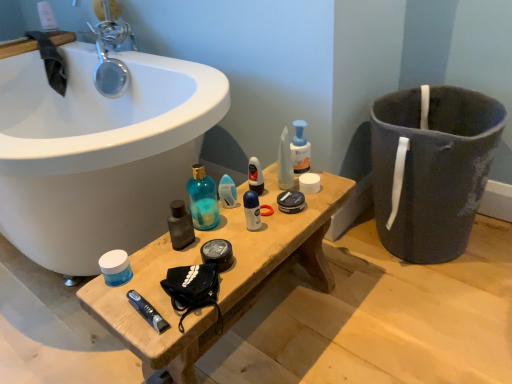
Question: Does blue matte jar at center, the first mouthwash in the left-to-right sequence, appear on the left side of shiny plastic mouthwash at center, acting as the second mouthwash starting from the front?

Choices:
 (A) yes
 (B) no

Answer: (A)

Question: From the image's perspective, would you say blue matte jar at center, placed as the third mouthwash when sorted from top to bottom, is shown under shiny plastic mouthwash at center, acting as the second mouthwash starting from the front?

Choices:
 (A) no
 (B) yes

Answer: (B)

Question: Is blue matte jar at center, positioned as the 3th mouthwash in back-to-front order, bigger than shiny plastic mouthwash at center, which is the 2th mouthwash from right to left?

Choices:
 (A) yes
 (B) no

Answer: (A)

Question: From a real-world perspective, does blue matte jar at center, the first mouthwash in the left-to-right sequence, sit lower than shiny plastic mouthwash at center, which is the 2th mouthwash in top-to-bottom order?

Choices:
 (A) no
 (B) yes

Answer: (B)

Question: Considering the relative sizes of blue matte jar at center, the 1th mouthwash from the bottom, and shiny plastic mouthwash at center, acting as the second mouthwash starting from the front, in the image provided, is blue matte jar at center, the 1th mouthwash from the bottom, shorter than shiny plastic mouthwash at center, acting as the second mouthwash starting from the front,?

Choices:
 (A) no
 (B) yes

Answer: (B)

Question: Is translucent plastic deodorant at center, the 3th toiletry positioned from the right, inside the boundaries of shiny plastic mouthwash at center, which ranks as the second mouthwash in bottom-to-top order, or outside?

Choices:
 (A) outside
 (B) inside

Answer: (A)

Question: Considering the positions of translucent plastic deodorant at center, the 1th toiletry positioned from the left, and shiny plastic mouthwash at center, which ranks as the second mouthwash in bottom-to-top order, in the image, is translucent plastic deodorant at center, the 1th toiletry positioned from the left, bigger or smaller than shiny plastic mouthwash at center, which ranks as the second mouthwash in bottom-to-top order,?

Choices:
 (A) small
 (B) big

Answer: (A)

Question: From a real-world perspective, is translucent plastic deodorant at center, the 3th toiletry positioned from the right, physically located above or below shiny plastic mouthwash at center, which ranks as the second mouthwash in bottom-to-top order?

Choices:
 (A) above
 (B) below

Answer: (B)

Question: Relative to shiny plastic mouthwash at center, which is the 2th mouthwash in top-to-bottom order, is translucent plastic deodorant at center, the 3th toiletry positioned from the right, in front or behind?

Choices:
 (A) behind
 (B) front

Answer: (B)

Question: Is blue matte jar at center, which is the 1th mouthwash in front-to-back order, taller or shorter than white matte deodorant at center, the 2th toiletry in the right-to-left sequence?

Choices:
 (A) short
 (B) tall

Answer: (A)

Question: Is blue matte jar at center, the first mouthwash in the left-to-right sequence, inside the boundaries of white matte deodorant at center, arranged as the 2th toiletry when viewed from the left, or outside?

Choices:
 (A) outside
 (B) inside

Answer: (A)

Question: Considering their positions, is blue matte jar at center, the first mouthwash in the left-to-right sequence, located in front of or behind white matte deodorant at center, arranged as the 2th toiletry when viewed from the left?

Choices:
 (A) front
 (B) behind

Answer: (A)

Question: From a real-world perspective, is blue matte jar at center, the 1th mouthwash from the bottom, above or below white matte deodorant at center, arranged as the 2th toiletry when viewed from the left?

Choices:
 (A) above
 (B) below

Answer: (B)

Question: Considering the positions of point (257, 196) and point (261, 190), is point (257, 196) closer or farther from the camera than point (261, 190)?

Choices:
 (A) closer
 (B) farther

Answer: (A)

Question: From the image's perspective, is white matte deodorant at center, the 2th toiletry in the right-to-left sequence, located above or below shiny plastic mouthwash at center, acting as the second mouthwash starting from the front?

Choices:
 (A) below
 (B) above

Answer: (A)